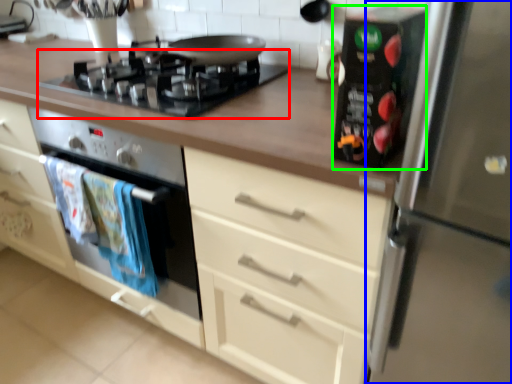
Question: Estimate the real-world distances between objects in this image. Which object is closer to gas stove (highlighted by a red box), refrigerator (highlighted by a blue box) or appliance (highlighted by a green box)?

Choices:
 (A) refrigerator
 (B) appliance

Answer: (B)